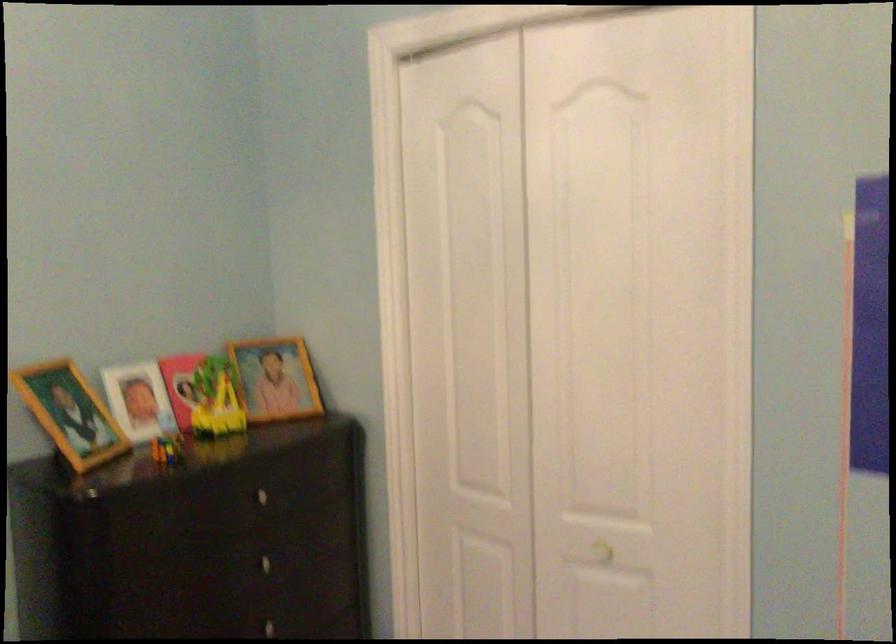
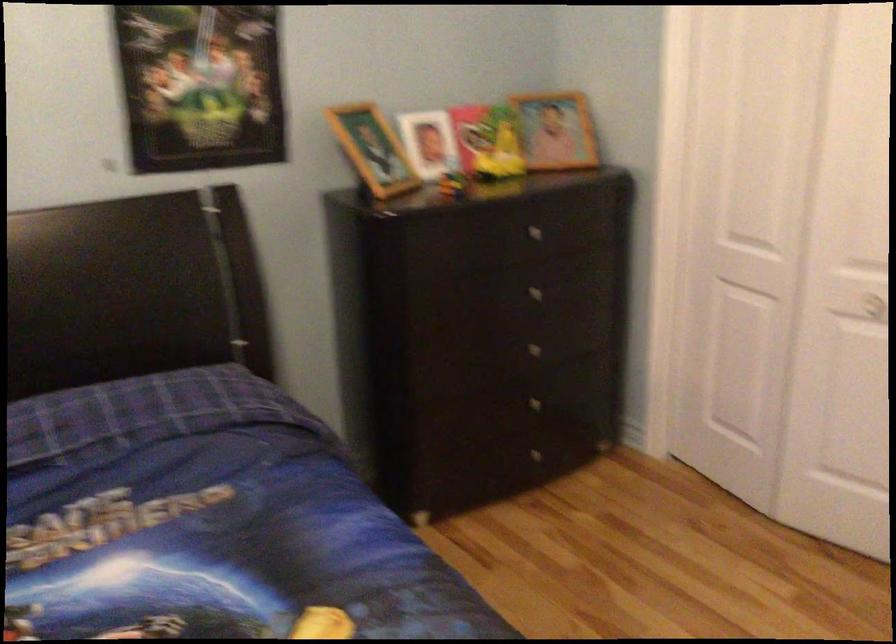
Question: The images are taken continuously from a first-person perspective. In which direction are you moving?

Choices:
 (A) Left
 (B) Right
 (C) Forward
 (D) Backward

Answer: (D)